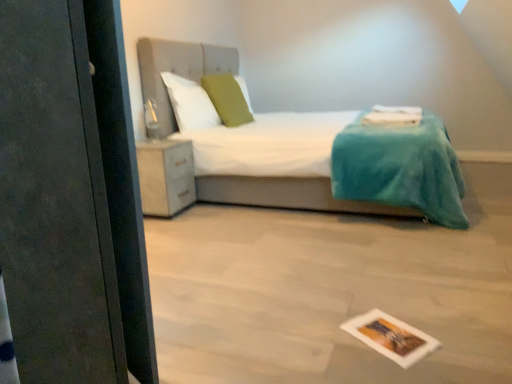
Find the location of a particular element. The image size is (512, 384). vacant space underneath printed paper postcard at lower center (from a real-world perspective) is located at coordinates (386, 335).